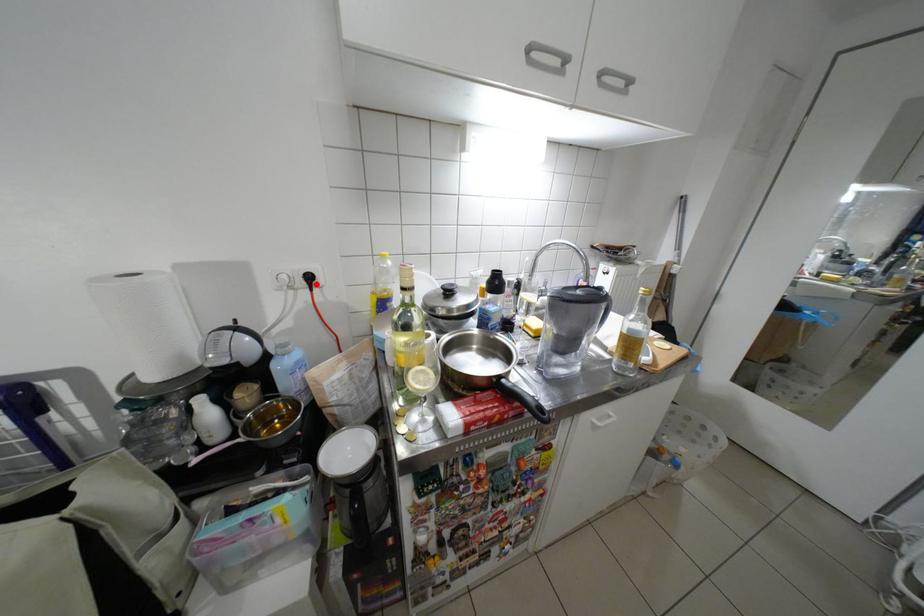
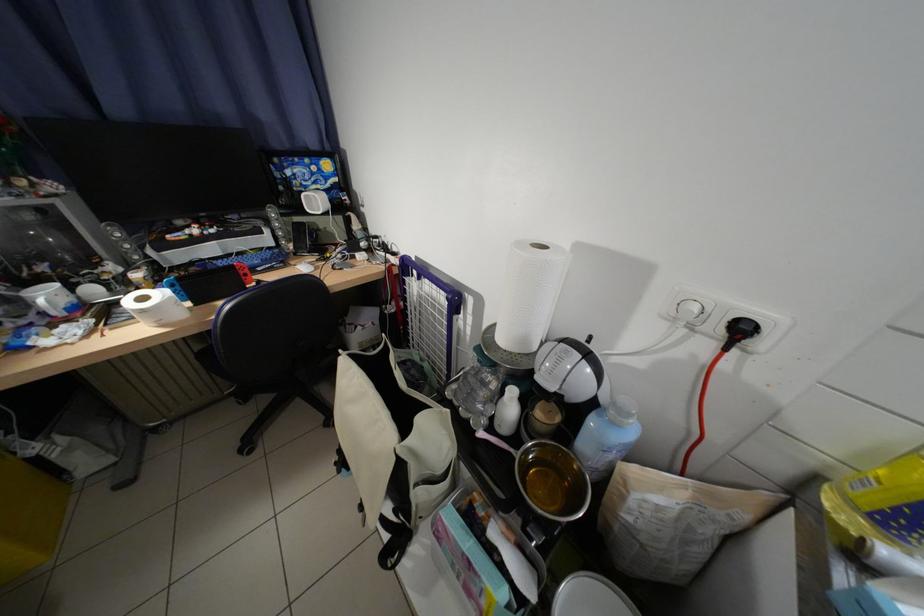
The point at the highlighted location is marked in the first image. Where is the corresponding point in the second image?

(734, 333)